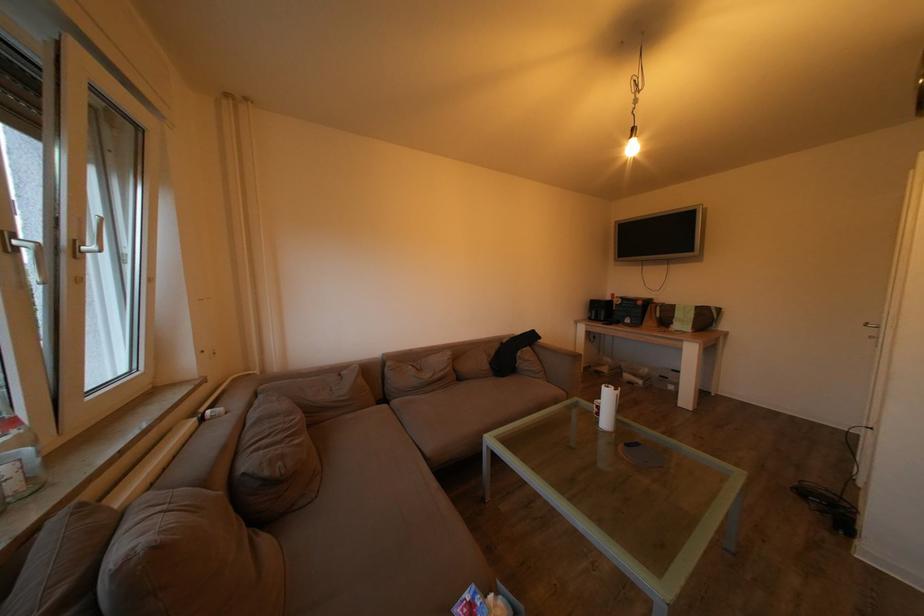
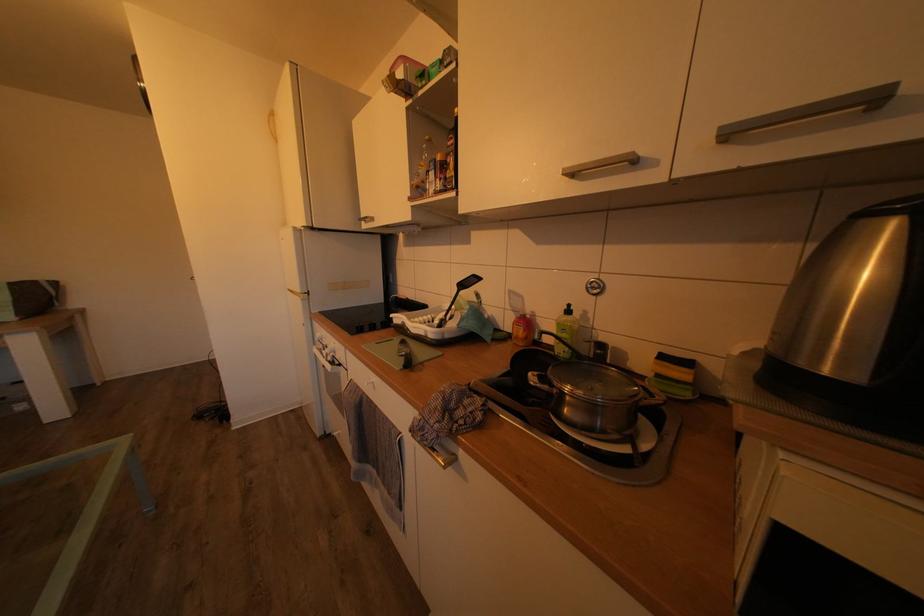
Question: How did the camera likely rotate?

Choices:
 (A) Left
 (B) Right
 (C) Up
 (D) Down

Answer: (B)